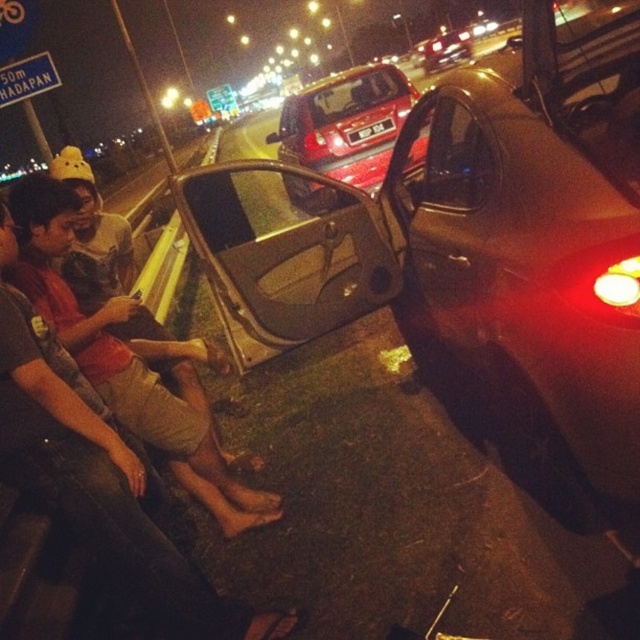
Looking at this image, does blue plastic sign at upper left have a greater height compared to glossy red car at center?

No, blue plastic sign at upper left is not taller than glossy red car at center.

Is blue plastic sign at upper left wider than glossy red car at center?

Incorrect, blue plastic sign at upper left's width does not surpass glossy red car at center's.

Where is `blue plastic sign at upper left`? Image resolution: width=640 pixels, height=640 pixels. blue plastic sign at upper left is located at coordinates (28, 77).

Is metallic silver car at center smaller than matte red shirt at lower left?

Yes.

At what (x,y) coordinates should I click in order to perform the action: click on metallic silver car at center. Please return your answer as a coordinate pair (x, y). The height and width of the screenshot is (640, 640). Looking at the image, I should click on (472, 244).

Does point (592, 100) lie in front of point (188, 483)?

Yes, point (592, 100) is closer to viewer.

Where is `metallic silver car at center`? The height and width of the screenshot is (640, 640). metallic silver car at center is located at coordinates (472, 244).

How much distance is there between metallic silver car at center and blue plastic sign at upper left?

The distance of metallic silver car at center from blue plastic sign at upper left is 3.95 meters.

Between metallic silver car at center and blue plastic sign at upper left, which one appears on the left side from the viewer's perspective?

From the viewer's perspective, blue plastic sign at upper left appears more on the left side.

Where is `metallic silver car at center`? Image resolution: width=640 pixels, height=640 pixels. metallic silver car at center is located at coordinates (472, 244).